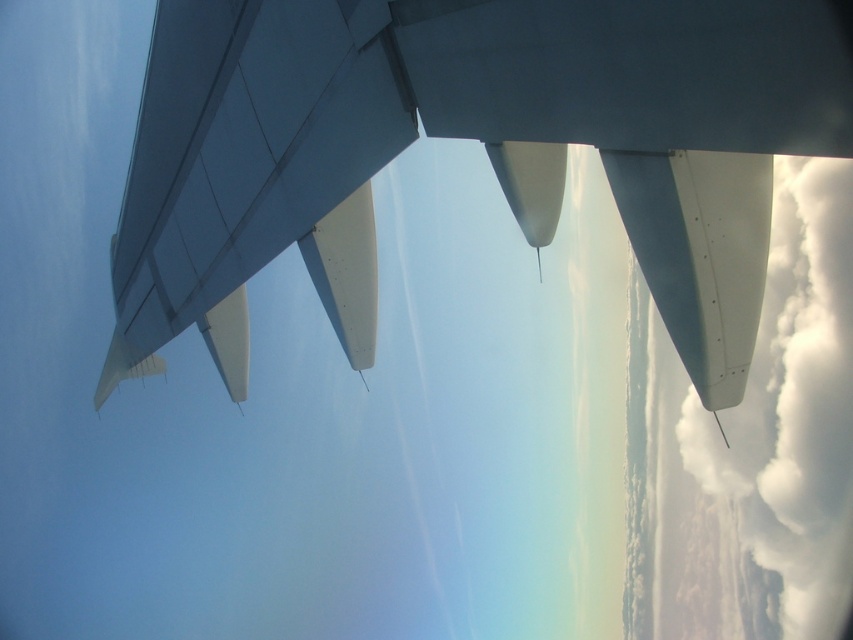
Question: Is matte white wing at upper left positioned in front of white fluffy cloud at right?

Choices:
 (A) yes
 (B) no

Answer: (B)

Question: Considering the relative positions of matte white wing at upper left and white fluffy cloud at right in the image provided, where is matte white wing at upper left located with respect to white fluffy cloud at right?

Choices:
 (A) below
 (B) above

Answer: (B)

Question: Which of the following is the farthest from the observer?

Choices:
 (A) (207, 170)
 (B) (842, 577)

Answer: (B)

Question: Can you confirm if matte white wing at upper left is positioned to the right of white fluffy cloud at right?

Choices:
 (A) no
 (B) yes

Answer: (A)

Question: Estimate the real-world distances between objects in this image. Which object is farther from the matte white wing at upper left?

Choices:
 (A) matte white wing at upper center
 (B) white fluffy cloud at right

Answer: (B)

Question: Which object is positioned farthest from the matte white wing at upper left?

Choices:
 (A) matte white wing at upper center
 (B) white fluffy cloud at right

Answer: (B)